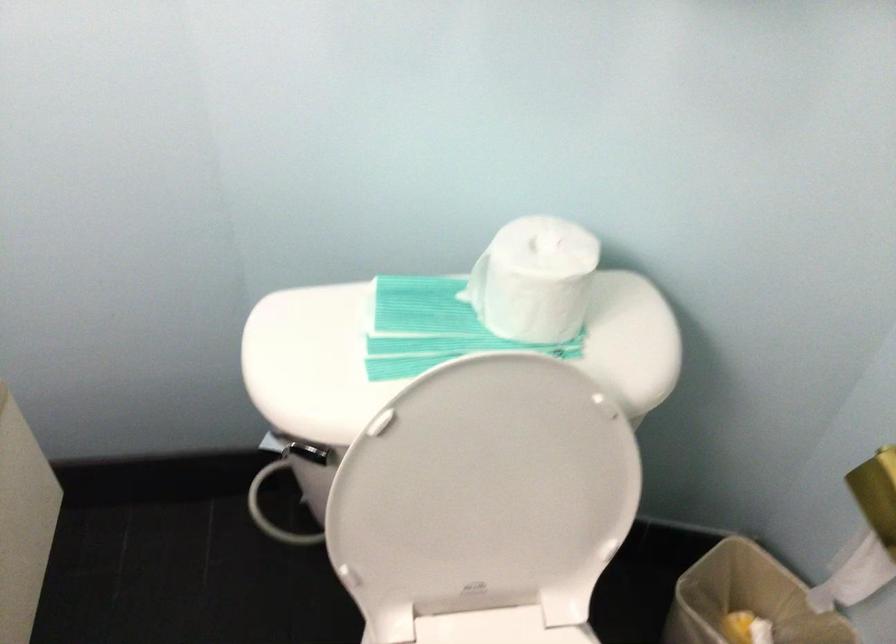
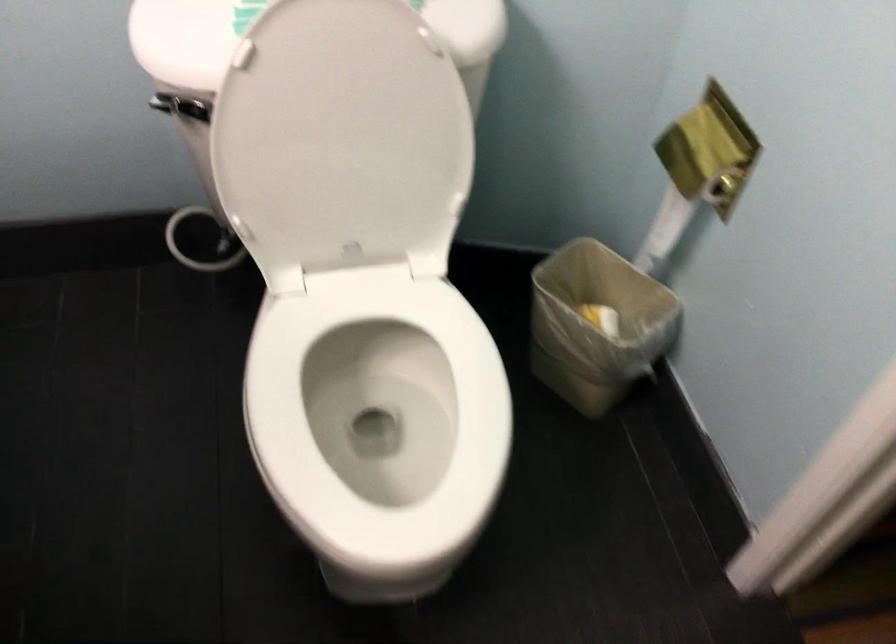
Question: Based on the continuous images, in which direction is the camera rotating? Reply with the corresponding letter.

Choices:
 (A) Left
 (B) Right
 (C) Up
 (D) Down

Answer: (D)